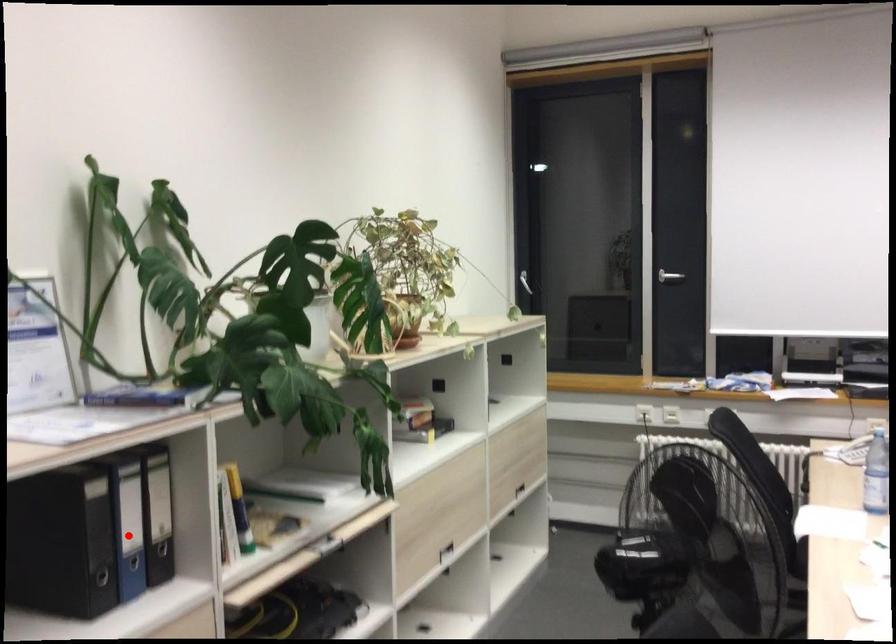
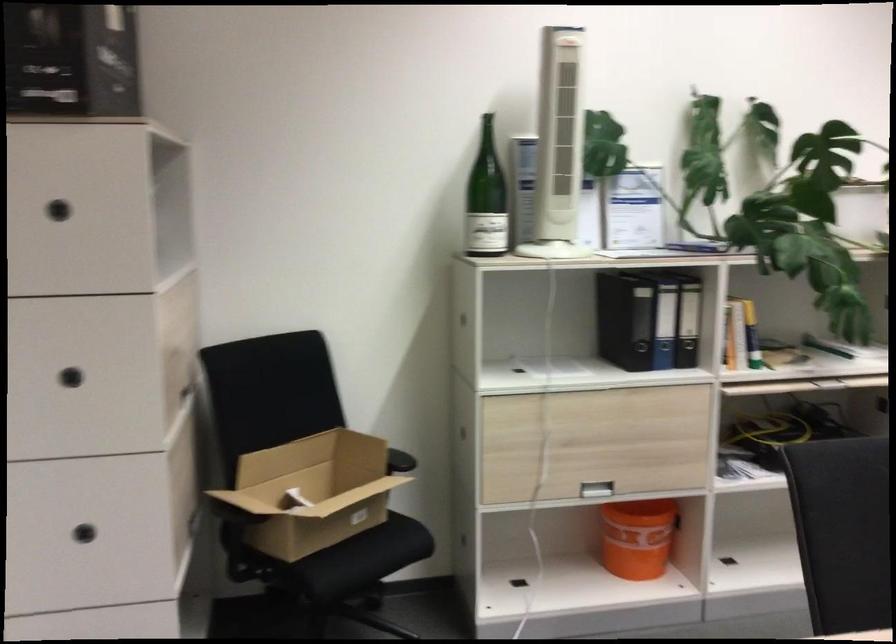
Find the pixel in the second image that matches the highlighted location in the first image.

(664, 325)